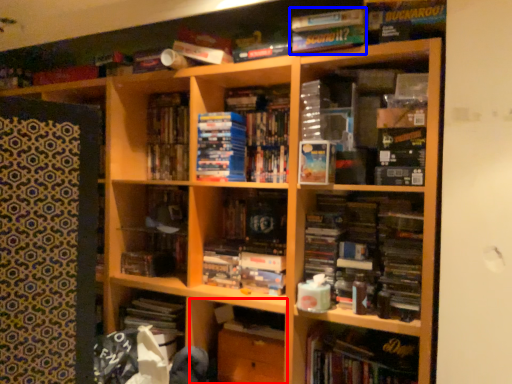
Question: Which of the following is the closest to the observer, cabinet (highlighted by a red box) or book (highlighted by a blue box)?

Choices:
 (A) cabinet
 (B) book

Answer: (B)